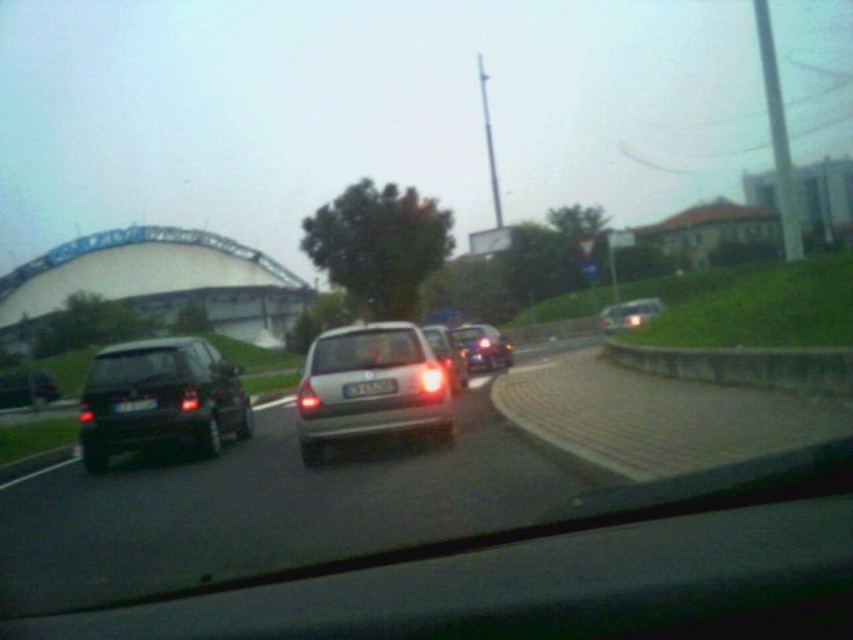
Can you confirm if matte black car at left is wider than black plastic license plate at center?

Yes, matte black car at left is wider than black plastic license plate at center.

Who is shorter, matte black car at left or black plastic license plate at center?

black plastic license plate at center is shorter.

The height and width of the screenshot is (640, 853). Find the location of `matte black car at left`. matte black car at left is located at coordinates (160, 397).

At what (x,y) coordinates should I click in order to perform the action: click on matte black car at left. Please return your answer as a coordinate pair (x, y). Image resolution: width=853 pixels, height=640 pixels. Looking at the image, I should click on (160, 397).

Does shiny silver car at center have a lesser width compared to satin silver car at center?

No.

Which of these two, shiny silver car at center or satin silver car at center, stands shorter?

satin silver car at center

Does point (488, 346) come closer to viewer compared to point (445, 342)?

No, (488, 346) is further to viewer.

This screenshot has height=640, width=853. What are the coordinates of `shiny silver car at center` in the screenshot? It's located at (482, 348).

Which is below, black matte car at left or black plastic license plate at center?

black matte car at left is below.

This screenshot has height=640, width=853. Find the location of `black matte car at left`. black matte car at left is located at coordinates (26, 388).